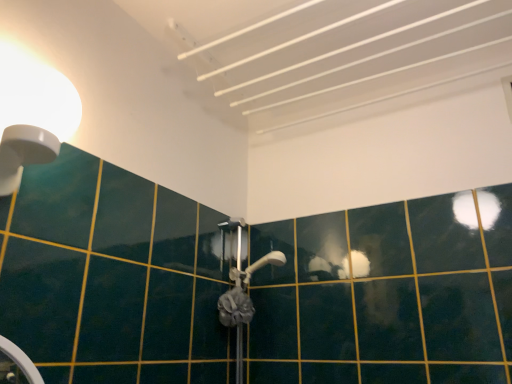
Question: Considering the positions of gray fabric shower at center and white glossy light fixture at upper left in the image, is gray fabric shower at center bigger or smaller than white glossy light fixture at upper left?

Choices:
 (A) big
 (B) small

Answer: (B)

Question: From the image's perspective, is gray fabric shower at center above or below white glossy light fixture at upper left?

Choices:
 (A) below
 (B) above

Answer: (A)

Question: From a real-world perspective, relative to white glossy light fixture at upper left, is gray fabric shower at center vertically above or below?

Choices:
 (A) above
 (B) below

Answer: (B)

Question: Visually, is white glossy light fixture at upper left positioned to the left or to the right of gray fabric shower at center?

Choices:
 (A) left
 (B) right

Answer: (A)

Question: From the image's perspective, is white glossy light fixture at upper left above or below gray fabric shower at center?

Choices:
 (A) above
 (B) below

Answer: (A)

Question: Is white glossy light fixture at upper left bigger or smaller than gray fabric shower at center?

Choices:
 (A) small
 (B) big

Answer: (B)

Question: Is white glossy light fixture at upper left in front of or behind gray fabric shower at center in the image?

Choices:
 (A) front
 (B) behind

Answer: (A)